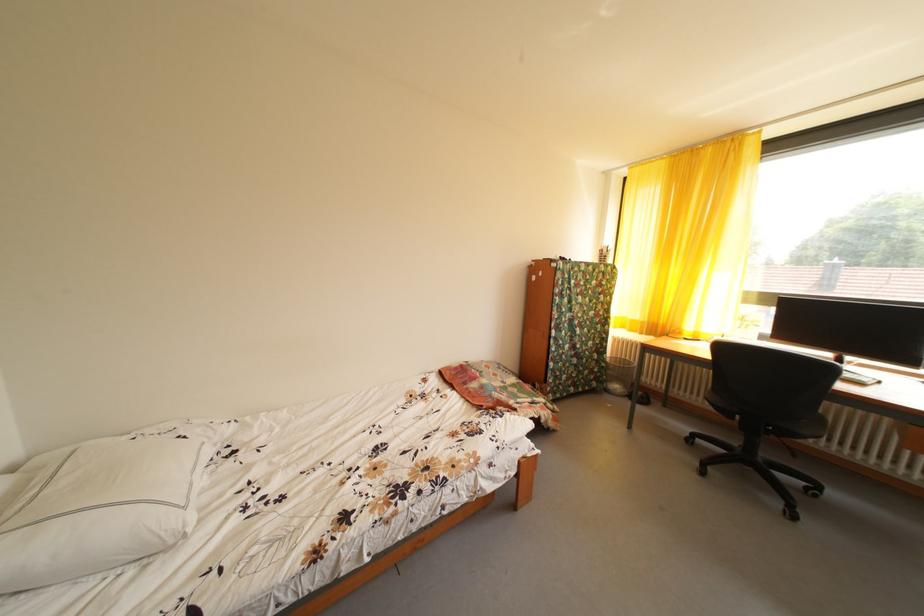
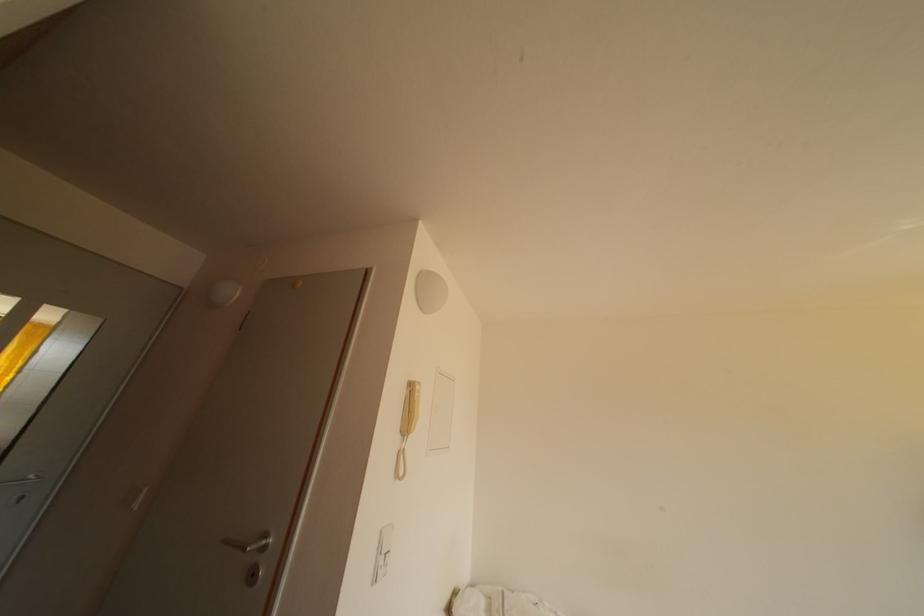
First-person continuous shooting, in which direction is the camera rotating?

The camera's rotation is toward left-up.